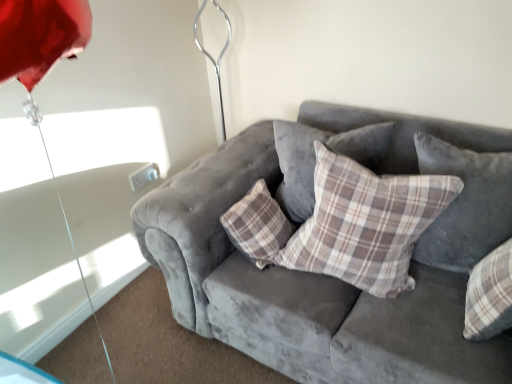
Question: Is velvet gray couch at center not close to plaid fabric pillow at center, which is counted as the 1th pillow, starting from the right?

Choices:
 (A) yes
 (B) no

Answer: (B)

Question: Is velvet gray couch at center thinner than plaid fabric pillow at center, which is counted as the 1th pillow, starting from the right?

Choices:
 (A) yes
 (B) no

Answer: (B)

Question: Is velvet gray couch at center aimed at plaid fabric pillow at center, arranged as the 3th pillow when viewed from the left?

Choices:
 (A) yes
 (B) no

Answer: (B)

Question: Does velvet gray couch at center lie in front of plaid fabric pillow at center, which is counted as the 1th pillow, starting from the right?

Choices:
 (A) no
 (B) yes

Answer: (B)

Question: Can you confirm if velvet gray couch at center is bigger than plaid fabric pillow at center, arranged as the 3th pillow when viewed from the left?

Choices:
 (A) yes
 (B) no

Answer: (A)

Question: From a real-world perspective, is velvet gray couch at center positioned above or below plaid fabric pillow at center, the 2th pillow from the right?

Choices:
 (A) above
 (B) below

Answer: (B)

Question: Considering the positions of velvet gray couch at center and plaid fabric pillow at center, the second pillow positioned from the left, in the image, is velvet gray couch at center wider or thinner than plaid fabric pillow at center, the second pillow positioned from the left,?

Choices:
 (A) thin
 (B) wide

Answer: (B)

Question: Do you think velvet gray couch at center is within plaid fabric pillow at center, the second pillow positioned from the left, or outside of it?

Choices:
 (A) outside
 (B) inside

Answer: (A)

Question: Considering their positions, is velvet gray couch at center located in front of or behind plaid fabric pillow at center, the second pillow positioned from the left?

Choices:
 (A) front
 (B) behind

Answer: (A)

Question: Is metallic silver umbrella at upper center spatially inside plaid fabric pillow at center, positioned as the 1th pillow in left-to-right order, or outside of it?

Choices:
 (A) outside
 (B) inside

Answer: (A)

Question: Is point (42, 21) positioned closer to the camera than point (310, 148)?

Choices:
 (A) farther
 (B) closer

Answer: (B)

Question: From a real-world perspective, is metallic silver umbrella at upper center positioned above or below plaid fabric pillow at center, positioned as the third pillow in right-to-left order?

Choices:
 (A) below
 (B) above

Answer: (B)

Question: Visually, is metallic silver umbrella at upper center positioned to the left or to the right of plaid fabric pillow at center, positioned as the 1th pillow in left-to-right order?

Choices:
 (A) left
 (B) right

Answer: (A)

Question: From their relative heights in the image, would you say plaid fabric pillow at center, the 2th pillow from the right, is taller or shorter than plaid fabric pillow at center, positioned as the 1th pillow in left-to-right order?

Choices:
 (A) short
 (B) tall

Answer: (B)

Question: Is plaid fabric pillow at center, the 2th pillow from the right, inside or outside of plaid fabric pillow at center, positioned as the third pillow in right-to-left order?

Choices:
 (A) inside
 (B) outside

Answer: (B)